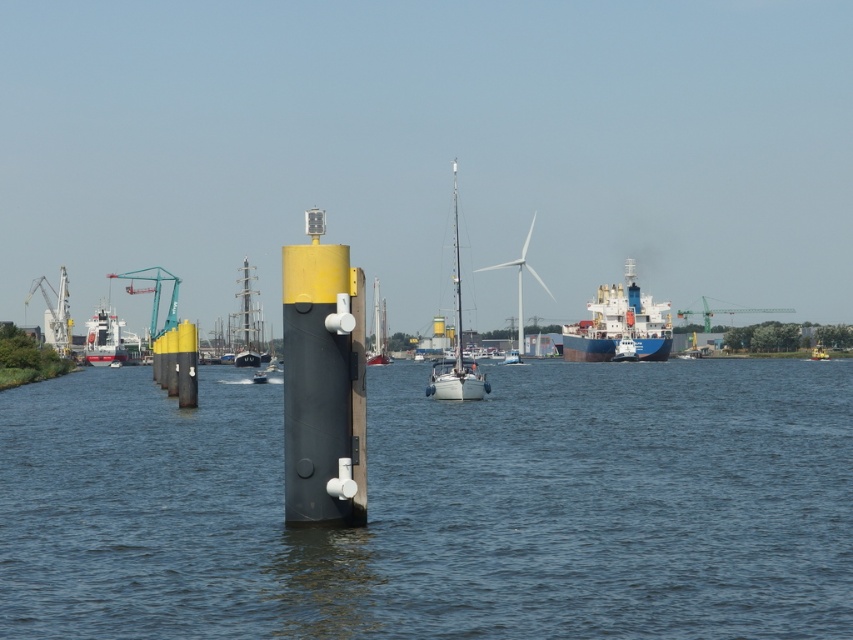
You are a harbor worker who needs to load a container onto the red sailboat at center and the green metallic crane at upper right. Which object requires a wider container to be handled?

The green metallic crane at upper right can handle wider containers since the red sailboat at center is narrower than the crane.

You are a photographer taking a picture of the harbor scene. You want to focus on the point closer to the camera between point (386,355) and point (701,296). Which point should you focus on?

You should focus on point (386,355) because it is closer to the camera than point (701,296).

You are a photographer trying to capture a clear shot of the shiny silver sailboat at center without the green metallic crane at upper right blocking it. Is this possible given their positions?

The shiny silver sailboat at center is in front of the green metallic crane at upper right, so the sailboat will block the view of the crane. Therefore, you cannot capture a clear shot of the sailboat without the crane being visible behind it.